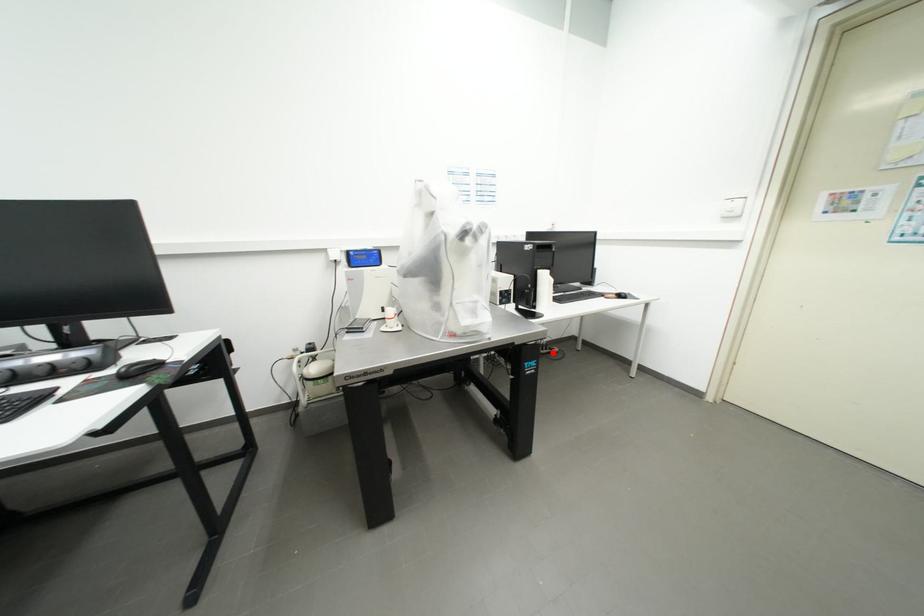
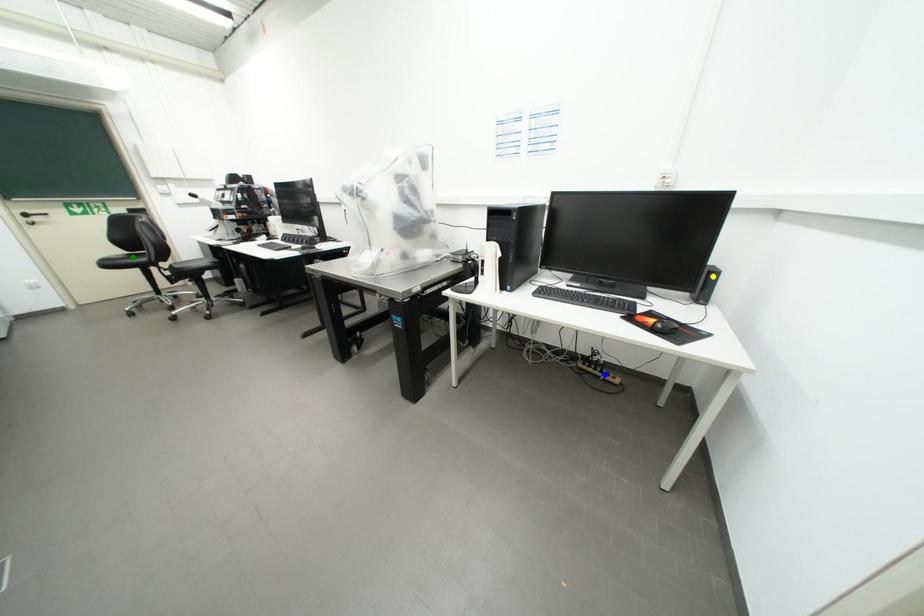
Question: I am providing you with two images of the same scene from different viewpoints. A red point is marked on the first image. You are given multiple points on the second image. In image 2, which mark is for the same physical point as the one in image 1?

Choices:
 (A) blue point
 (B) yellow point
 (C) green point

Answer: (A)